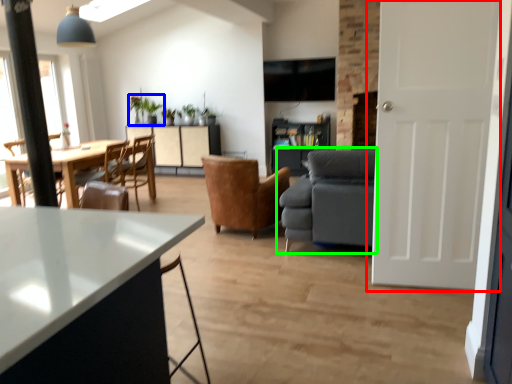
Question: Considering the real-world distances, which object is farthest from door (highlighted by a red box)? houseplant (highlighted by a blue box) or studio couch (highlighted by a green box)?

Choices:
 (A) houseplant
 (B) studio couch

Answer: (A)